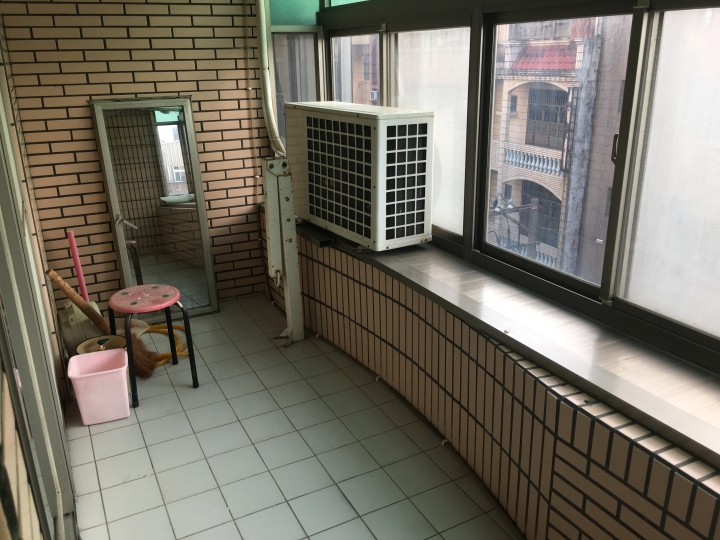
The width and height of the screenshot is (720, 540). I want to click on windows, so click(x=289, y=66), click(x=441, y=81), click(x=520, y=96), click(x=672, y=158).